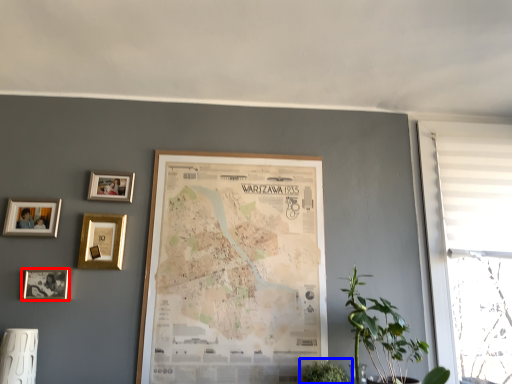
Question: Among these objects, which one is farthest to the camera, picture frame (highlighted by a red box) or houseplant (highlighted by a blue box)?

Choices:
 (A) picture frame
 (B) houseplant

Answer: (A)